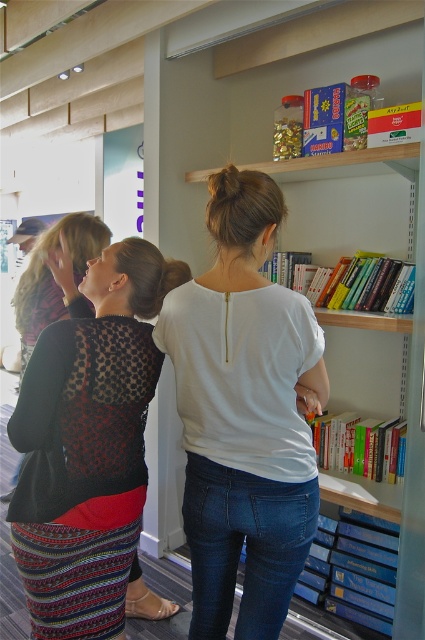
You are a fashion designer observing two people in the scene. The first person is wearing a black lace top at left and a patterned fabric dress at left. Which clothing item is taller?

The black lace top at left is much taller than the patterned fabric dress at left.

You are a photographer setting up a shoot in the scene described. You need to ensure that the white matte shirt at center and the black lace top at left are both visible in the frame. Given their sizes, which top should you focus on to ensure both are captured clearly?

The white matte shirt at center is larger in size than the black lace top at left, so focusing on the white matte shirt at center would help ensure both are visible since it occupies more space and can be positioned to include the smaller black lace top at left in the frame.

What are the coordinates of the black lace top at left in the image?

The coordinates of the black lace top at left are at point (x=93, y=429).